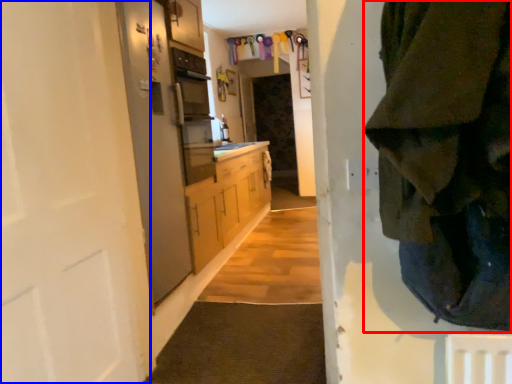
Question: Among these objects, which one is farthest to the camera, clothing (highlighted by a red box) or door (highlighted by a blue box)?

Choices:
 (A) clothing
 (B) door

Answer: (B)